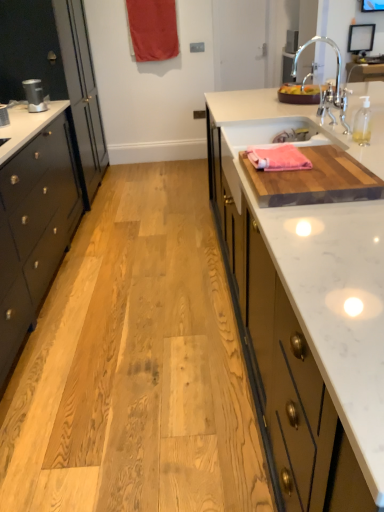
Question: Is the depth of pink woven towel at upper right greater than that of matte black speaker at left?

Choices:
 (A) no
 (B) yes

Answer: (A)

Question: Is pink woven towel at upper right thinner than matte black speaker at left?

Choices:
 (A) no
 (B) yes

Answer: (A)

Question: Is pink woven towel at upper right closer to camera compared to matte black speaker at left?

Choices:
 (A) yes
 (B) no

Answer: (A)

Question: Would you say pink woven towel at upper right contains matte black speaker at left?

Choices:
 (A) no
 (B) yes

Answer: (A)

Question: Is pink woven towel at upper right facing away from matte black speaker at left?

Choices:
 (A) no
 (B) yes

Answer: (A)

Question: Considering the positions of black glossy cabinet at left and white ceramic sink at upper right in the image, is black glossy cabinet at left bigger or smaller than white ceramic sink at upper right?

Choices:
 (A) small
 (B) big

Answer: (B)

Question: From their relative heights in the image, would you say black glossy cabinet at left is taller or shorter than white ceramic sink at upper right?

Choices:
 (A) short
 (B) tall

Answer: (A)

Question: Is black glossy cabinet at left wider or thinner than white ceramic sink at upper right?

Choices:
 (A) wide
 (B) thin

Answer: (A)

Question: From the image's perspective, relative to white ceramic sink at upper right, is black glossy cabinet at left above or below?

Choices:
 (A) below
 (B) above

Answer: (A)

Question: Looking at the image, does pink woven towel at upper right seem bigger or smaller compared to white marble countertop at right?

Choices:
 (A) big
 (B) small

Answer: (B)

Question: Is pink woven towel at upper right in front of or behind white marble countertop at right in the image?

Choices:
 (A) front
 (B) behind

Answer: (B)

Question: In terms of width, does pink woven towel at upper right look wider or thinner when compared to white marble countertop at right?

Choices:
 (A) thin
 (B) wide

Answer: (A)

Question: Based on their positions, is pink woven towel at upper right located to the left or right of white marble countertop at right?

Choices:
 (A) left
 (B) right

Answer: (A)

Question: Considering the positions of chrome metallic faucet at upper right and pink woven towel at upper right in the image, is chrome metallic faucet at upper right taller or shorter than pink woven towel at upper right?

Choices:
 (A) short
 (B) tall

Answer: (B)

Question: Based on their sizes in the image, would you say chrome metallic faucet at upper right is bigger or smaller than pink woven towel at upper right?

Choices:
 (A) small
 (B) big

Answer: (B)